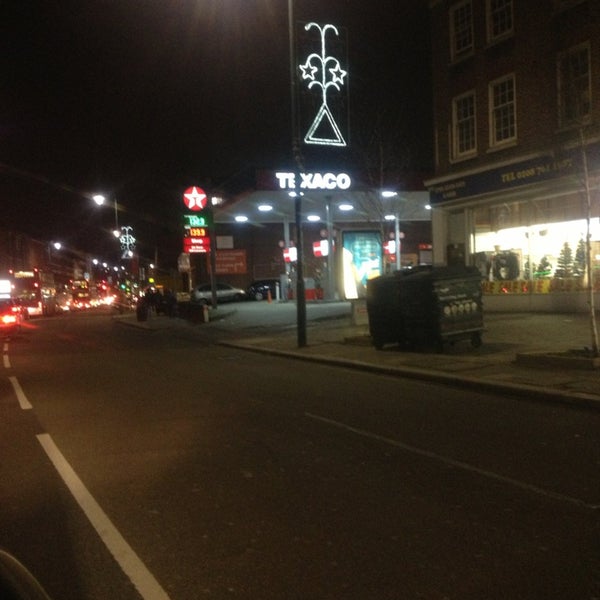
Find the location of a particular element. The width and height of the screenshot is (600, 600). christmas trees is located at coordinates (561, 261), (577, 257), (545, 261), (528, 266).